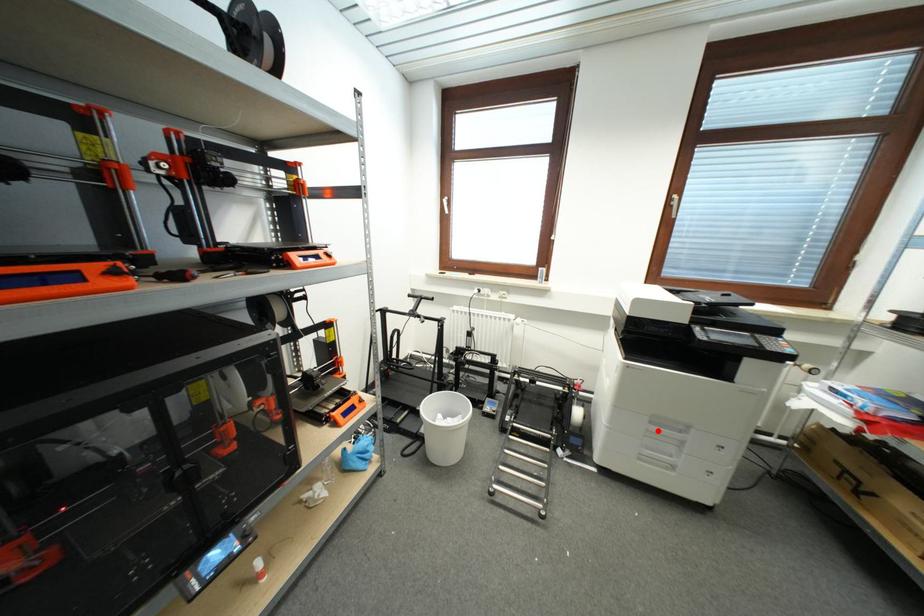
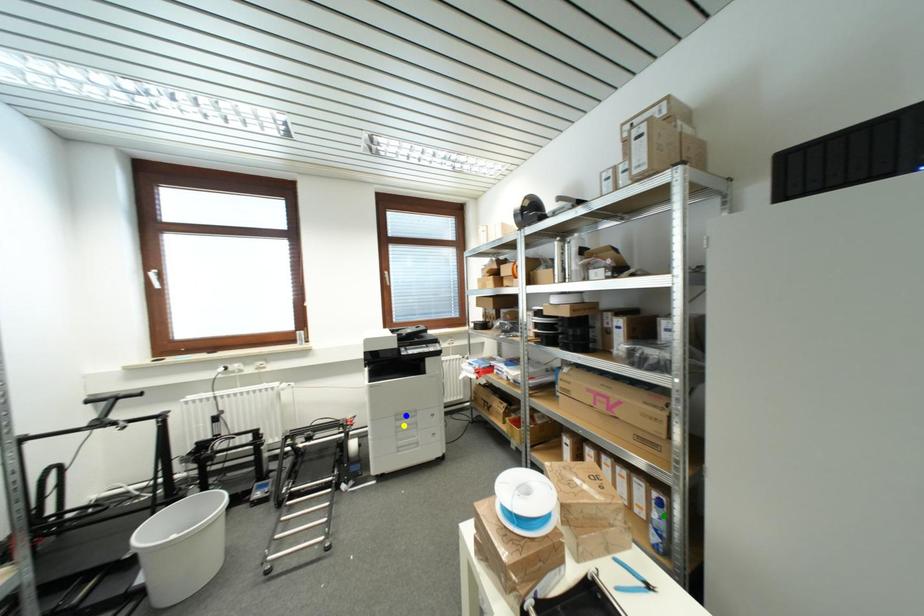
Question: I am providing you with two images of the same scene from different viewpoints. A red point is marked on the first image. You are given multiple points on the second image. Which point in image 2 is actually the same real-world point as the red point in image 1?

Choices:
 (A) yellow point
 (B) blue point
 (C) green point

Answer: (A)